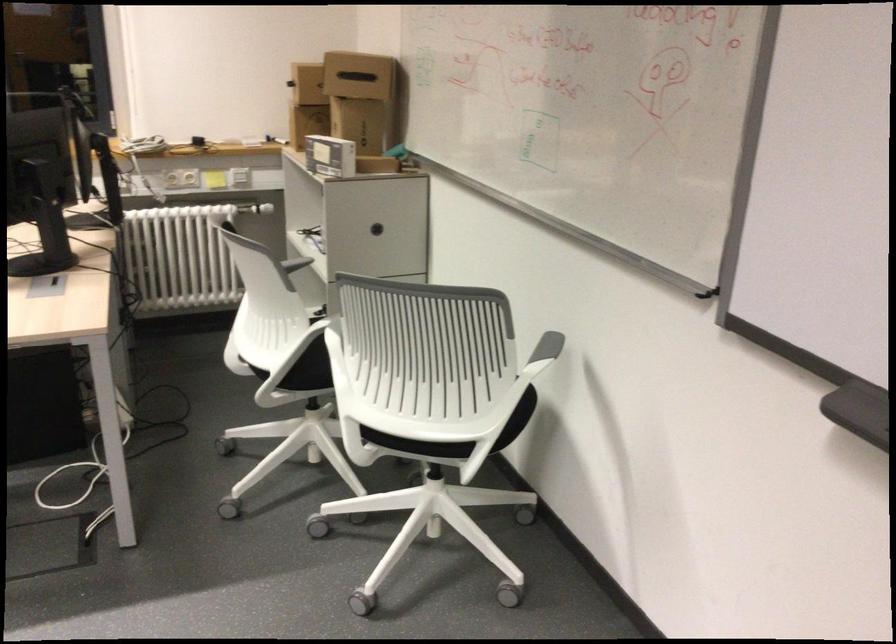
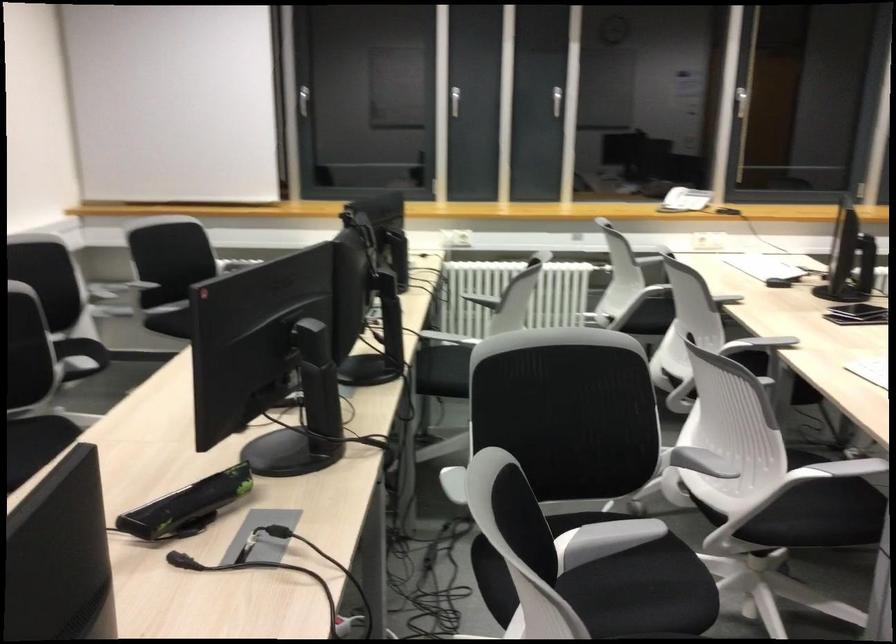
Which direction would the cameraman need to move to produce the second image?

The movement direction of the cameraman is left, backward.